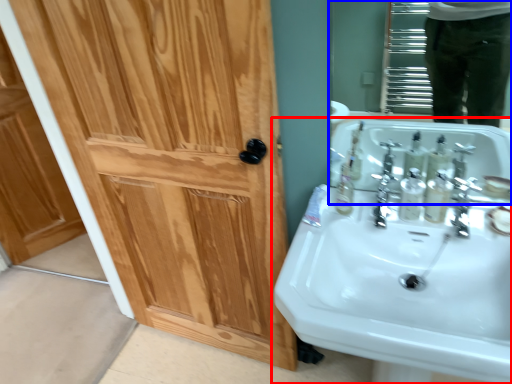
Question: Which of the following is the farthest to the observer, sink (highlighted by a red box) or mirror (highlighted by a blue box)?

Choices:
 (A) sink
 (B) mirror

Answer: (B)